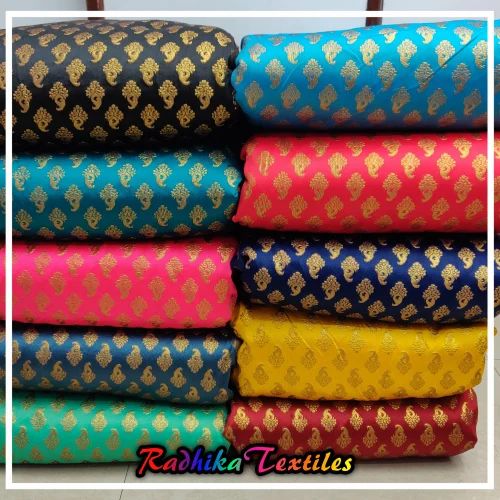
The height and width of the screenshot is (500, 500). I want to click on corner, so click(x=479, y=469), click(x=27, y=475), click(x=23, y=29), click(x=476, y=25).